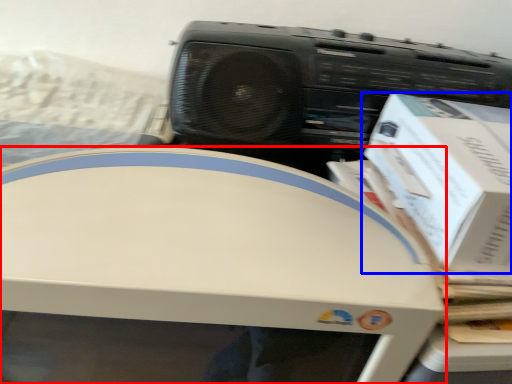
Question: Which point is further to the camera, home appliance (highlighted by a red box) or box (highlighted by a blue box)?

Choices:
 (A) home appliance
 (B) box

Answer: (B)